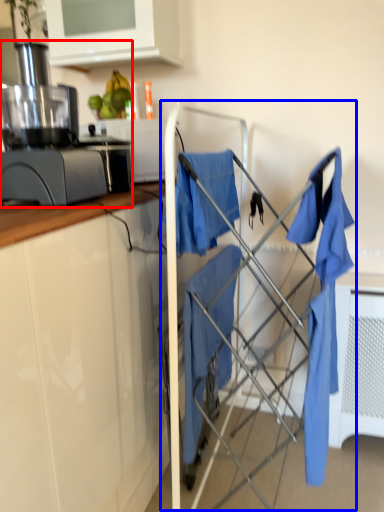
Question: Which point is closer to the camera, home appliance (highlighted by a red box) or baby carriage (highlighted by a blue box)?

Choices:
 (A) home appliance
 (B) baby carriage

Answer: (A)